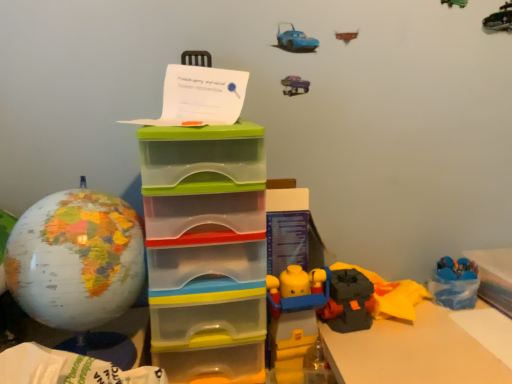
Question: Considering the relative positions of translucent plastic storage box at center, arranged as the 1th storage box when viewed from the left, and matte globe at left in the image provided, is translucent plastic storage box at center, arranged as the 1th storage box when viewed from the left, behind matte globe at left?

Choices:
 (A) yes
 (B) no

Answer: (A)

Question: Does translucent plastic storage box at center, arranged as the 1th storage box when viewed from the left, appear on the right side of matte globe at left?

Choices:
 (A) yes
 (B) no

Answer: (A)

Question: Is translucent plastic storage box at center, arranged as the 1th storage box when viewed from the left, at the left side of matte globe at left?

Choices:
 (A) yes
 (B) no

Answer: (B)

Question: From a real-world perspective, is translucent plastic storage box at center, arranged as the 1th storage box when viewed from the left, over matte globe at left?

Choices:
 (A) no
 (B) yes

Answer: (A)

Question: From the image's perspective, does translucent plastic storage box at center, the second storage box when ordered from right to left, appear higher than matte globe at left?

Choices:
 (A) yes
 (B) no

Answer: (B)

Question: Based on their sizes in the image, would you say matte globe at left is bigger or smaller than translucent plastic storage box at center, arranged as the 1th storage box when viewed from the left?

Choices:
 (A) small
 (B) big

Answer: (A)

Question: From the image's perspective, is matte globe at left above or below translucent plastic storage box at center, the second storage box when ordered from right to left?

Choices:
 (A) below
 (B) above

Answer: (B)

Question: In the image, is matte globe at left on the left side or the right side of translucent plastic storage box at center, arranged as the 1th storage box when viewed from the left?

Choices:
 (A) right
 (B) left

Answer: (B)

Question: Is point (53, 241) closer or farther from the camera than point (179, 319)?

Choices:
 (A) closer
 (B) farther

Answer: (A)

Question: Is blue plastic storage box at lower right, which ranks as the 2th storage box in left-to-right order, bigger or smaller than translucent plastic storage box at center, arranged as the 1th storage box when viewed from the left?

Choices:
 (A) big
 (B) small

Answer: (B)

Question: Considering the positions of blue plastic storage box at lower right, which ranks as the 2th storage box in left-to-right order, and translucent plastic storage box at center, arranged as the 1th storage box when viewed from the left, in the image, is blue plastic storage box at lower right, which ranks as the 2th storage box in left-to-right order, taller or shorter than translucent plastic storage box at center, arranged as the 1th storage box when viewed from the left,?

Choices:
 (A) short
 (B) tall

Answer: (A)

Question: Is blue plastic storage box at lower right, which ranks as the first storage box in right-to-left order, inside or outside of translucent plastic storage box at center, arranged as the 1th storage box when viewed from the left?

Choices:
 (A) outside
 (B) inside

Answer: (A)

Question: From a real-world perspective, is blue plastic storage box at lower right, which ranks as the 2th storage box in left-to-right order, physically located above or below translucent plastic storage box at center, arranged as the 1th storage box when viewed from the left?

Choices:
 (A) below
 (B) above

Answer: (A)

Question: Considering the positions of blue plastic storage box at lower right, which ranks as the first storage box in right-to-left order, and matte globe at left in the image, is blue plastic storage box at lower right, which ranks as the first storage box in right-to-left order, taller or shorter than matte globe at left?

Choices:
 (A) short
 (B) tall

Answer: (A)

Question: Considering the positions of blue plastic storage box at lower right, which ranks as the 2th storage box in left-to-right order, and matte globe at left in the image, is blue plastic storage box at lower right, which ranks as the 2th storage box in left-to-right order, bigger or smaller than matte globe at left?

Choices:
 (A) big
 (B) small

Answer: (B)